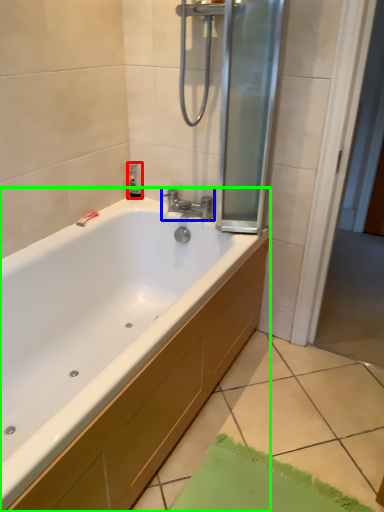
Question: Which object is positioned closest to toiletry (highlighted by a red box)? Select from tap (highlighted by a blue box) and bathtub (highlighted by a green box).

Choices:
 (A) tap
 (B) bathtub

Answer: (A)